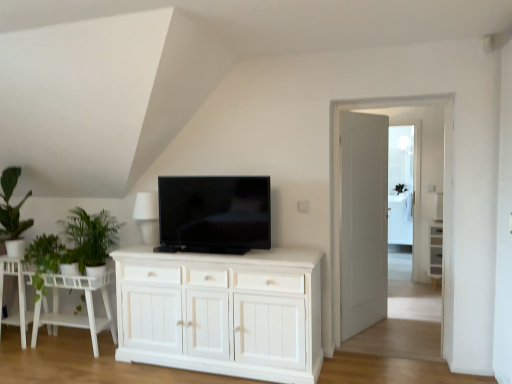
Question: Could you tell me if black glossy tv at center is turned towards transparent glass door at center, which appears as the 2th glass door when viewed from the left?

Choices:
 (A) yes
 (B) no

Answer: (B)

Question: Considering the relative sizes of black glossy tv at center and transparent glass door at center, which appears as the first glass door when viewed from the back, in the image provided, is black glossy tv at center wider than transparent glass door at center, which appears as the first glass door when viewed from the back,?

Choices:
 (A) yes
 (B) no

Answer: (A)

Question: From a real-world perspective, is black glossy tv at center positioned under transparent glass door at center, which appears as the first glass door when viewed from the back, based on gravity?

Choices:
 (A) yes
 (B) no

Answer: (B)

Question: Does black glossy tv at center lie in front of transparent glass door at center, which appears as the 2th glass door when viewed from the left?

Choices:
 (A) no
 (B) yes

Answer: (B)

Question: From the image's perspective, is black glossy tv at center beneath transparent glass door at center, which appears as the first glass door when viewed from the back?

Choices:
 (A) yes
 (B) no

Answer: (A)

Question: Is black glossy tv at center further to the viewer compared to transparent glass door at center, which appears as the first glass door when viewed from the back?

Choices:
 (A) no
 (B) yes

Answer: (A)

Question: From a real-world perspective, does transparent glass door at center, the first glass door positioned from the right, stand above green matte plant at left?

Choices:
 (A) no
 (B) yes

Answer: (A)

Question: Is transparent glass door at center, which appears as the first glass door when viewed from the back, next to green matte plant at left?

Choices:
 (A) no
 (B) yes

Answer: (A)

Question: From the image's perspective, does transparent glass door at center, which appears as the 2th glass door when viewed from the front, appear higher than green matte plant at left?

Choices:
 (A) yes
 (B) no

Answer: (A)

Question: Does transparent glass door at center, which appears as the 2th glass door when viewed from the left, have a smaller size compared to green matte plant at left?

Choices:
 (A) yes
 (B) no

Answer: (A)

Question: From a real-world perspective, is transparent glass door at center, which appears as the first glass door when viewed from the back, beneath green matte plant at left?

Choices:
 (A) no
 (B) yes

Answer: (B)

Question: Is transparent glass door at center, the first glass door positioned from the right, not close to green matte plant at left?

Choices:
 (A) no
 (B) yes

Answer: (B)

Question: Is transparent glass door at center, arranged as the 2th glass door when viewed from the right, positioned far away from black glossy tv at center?

Choices:
 (A) no
 (B) yes

Answer: (B)